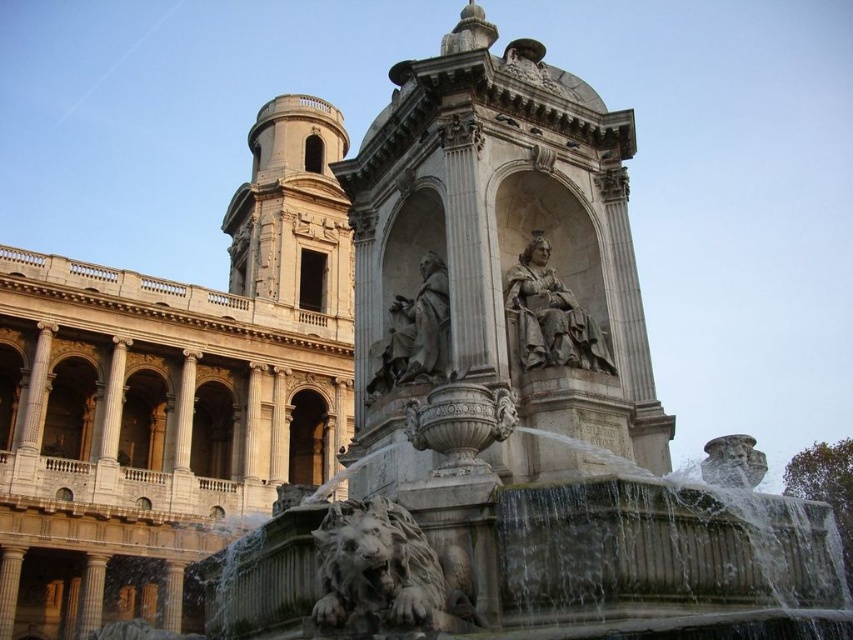
Question: Which object is closer to the camera taking this photo?

Choices:
 (A) gray stone statue at center
 (B) polished stone statue at center

Answer: (B)

Question: Which of the following is the farthest from the observer?

Choices:
 (A) gray stone statue at center
 (B) polished stone statue at center
 (C) white marble statue at center

Answer: (A)

Question: Where is polished stone statue at center located in relation to gray stone statue at center in the image?

Choices:
 (A) right
 (B) left

Answer: (A)

Question: Can you confirm if white marble statue at center is positioned above gray stone statue at center?

Choices:
 (A) yes
 (B) no

Answer: (A)

Question: Among these objects, which one is farthest from the camera?

Choices:
 (A) gray stone statue at center
 (B) polished stone statue at center

Answer: (A)

Question: Where is polished stone statue at center located in relation to gray stone statue at center in the image?

Choices:
 (A) left
 (B) right

Answer: (B)